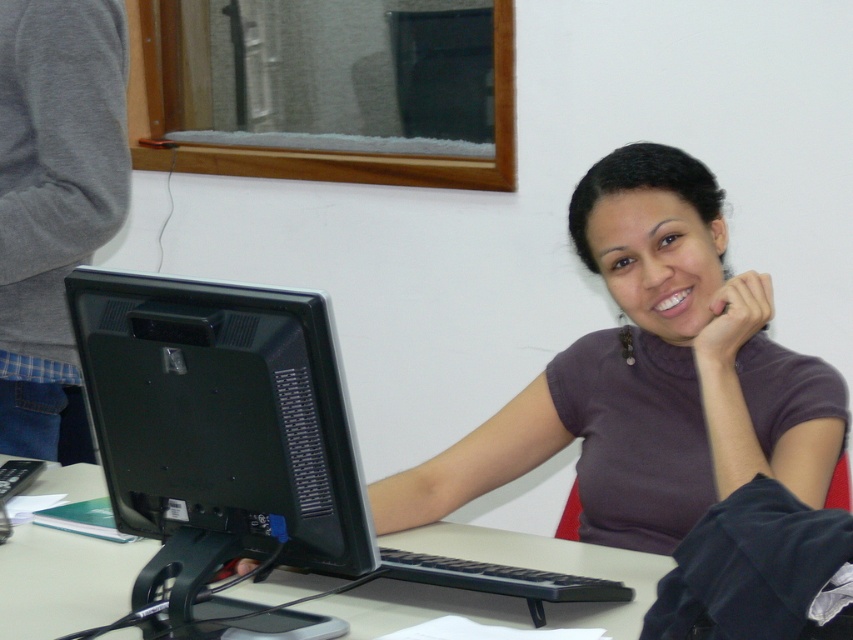
Which is above, matte purple shirt at center or black plastic monitor at center?

matte purple shirt at center is higher up.

I want to click on matte purple shirt at center, so click(650, 376).

This screenshot has width=853, height=640. I want to click on matte purple shirt at center, so (x=650, y=376).

Is black plastic monitor at center smaller than white plastic computer desk at center?

Indeed, black plastic monitor at center has a smaller size compared to white plastic computer desk at center.

Identify the location of black plastic monitor at center. The height and width of the screenshot is (640, 853). (219, 428).

Which is below, matte purple shirt at center or white plastic computer desk at center?

Positioned lower is white plastic computer desk at center.

Does matte purple shirt at center have a lesser width compared to white plastic computer desk at center?

Yes, matte purple shirt at center is thinner than white plastic computer desk at center.

Is point (676, 173) positioned in front of point (547, 547)?

That is True.

What are the coordinates of `matte purple shirt at center` in the screenshot? It's located at (650, 376).